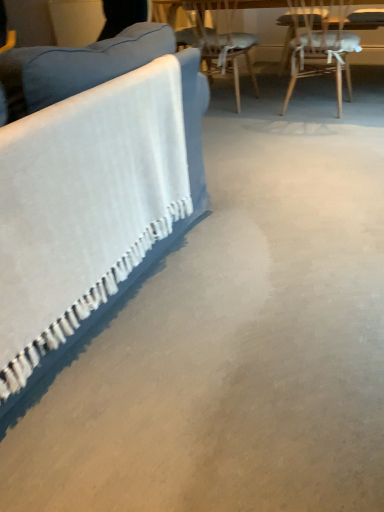
Consider the image. Measure the distance between point (300, 48) and camera.

Point (300, 48) and camera are 9.69 feet apart.

At what (x,y) coordinates should I click in order to perform the action: click on wooden chair at upper right, placed as the first chair when sorted from right to left. Please return your answer as a coordinate pair (x, y). The height and width of the screenshot is (512, 384). Looking at the image, I should click on (320, 42).

I want to click on wooden chair at upper right, which ranks as the 2th chair in left-to-right order, so click(x=320, y=42).

Is wooden chair at upper right, which ranks as the 2th chair in left-to-right order, wider or thinner than wooden chair at upper right, arranged as the 1th chair when viewed from the left?

wooden chair at upper right, which ranks as the 2th chair in left-to-right order, is wider than wooden chair at upper right, arranged as the 1th chair when viewed from the left.

From the image's perspective, does wooden chair at upper right, which ranks as the 2th chair in left-to-right order, appear lower than wooden chair at upper right, which is the second chair in right-to-left order?

Yes, from the image's perspective, wooden chair at upper right, which ranks as the 2th chair in left-to-right order, is below wooden chair at upper right, which is the second chair in right-to-left order.

Are wooden chair at upper right, placed as the first chair when sorted from right to left, and wooden chair at upper right, arranged as the 1th chair when viewed from the left, located far from each other?

No, wooden chair at upper right, placed as the first chair when sorted from right to left, is in close proximity to wooden chair at upper right, arranged as the 1th chair when viewed from the left.

How far apart are wooden chair at upper right, placed as the first chair when sorted from right to left, and wooden chair at upper right, arranged as the 1th chair when viewed from the left?

wooden chair at upper right, placed as the first chair when sorted from right to left, and wooden chair at upper right, arranged as the 1th chair when viewed from the left, are 24.67 inches apart.

From a real-world perspective, is blue fabric couch at left physically located above or below wooden chair at upper right, which is the second chair in right-to-left order?

blue fabric couch at left is situated higher than wooden chair at upper right, which is the second chair in right-to-left order, in the real world.

Based on the photo, considering the relative sizes of blue fabric couch at left and wooden chair at upper right, arranged as the 1th chair when viewed from the left, in the image provided, is blue fabric couch at left taller than wooden chair at upper right, arranged as the 1th chair when viewed from the left,?

Yes, blue fabric couch at left is taller than wooden chair at upper right, arranged as the 1th chair when viewed from the left.

Is blue fabric couch at left inside or outside of wooden chair at upper right, which is the second chair in right-to-left order?

blue fabric couch at left lies outside wooden chair at upper right, which is the second chair in right-to-left order.

Does blue fabric couch at left touch wooden chair at upper right, arranged as the 1th chair when viewed from the left?

blue fabric couch at left is not next to wooden chair at upper right, arranged as the 1th chair when viewed from the left, and they're not touching.

Is blue fabric couch at left in front of or behind wooden chair at upper right, which ranks as the 2th chair in left-to-right order, in the image?

blue fabric couch at left is in front of wooden chair at upper right, which ranks as the 2th chair in left-to-right order.

From a real-world perspective, is blue fabric couch at left above or below wooden chair at upper right, placed as the first chair when sorted from right to left?

In terms of real-world spatial position, blue fabric couch at left is above wooden chair at upper right, placed as the first chair when sorted from right to left.

From the image's perspective, is blue fabric couch at left over wooden chair at upper right, which ranks as the 2th chair in left-to-right order?

No.

Considering the positions of objects wooden chair at upper right, arranged as the 1th chair when viewed from the left, and wooden chair at upper right, placed as the first chair when sorted from right to left, in the image provided, who is more to the right, wooden chair at upper right, arranged as the 1th chair when viewed from the left, or wooden chair at upper right, placed as the first chair when sorted from right to left,?

wooden chair at upper right, placed as the first chair when sorted from right to left.

This screenshot has height=512, width=384. I want to click on chair that appears below the wooden chair at upper right, which is the second chair in right-to-left order (from a real-world perspective), so click(320, 42).

Between wooden chair at upper right, arranged as the 1th chair when viewed from the left, and wooden chair at upper right, which ranks as the 2th chair in left-to-right order, which one has smaller width?

wooden chair at upper right, arranged as the 1th chair when viewed from the left, is thinner.

From the picture: From the image's perspective, which one is positioned lower, wooden chair at upper right, which is the second chair in right-to-left order, or blue fabric couch at left?

blue fabric couch at left.

Is wooden chair at upper right, which is the second chair in right-to-left order, bigger than blue fabric couch at left?

No, wooden chair at upper right, which is the second chair in right-to-left order, is not bigger than blue fabric couch at left.

From a real-world perspective, is wooden chair at upper right, which is the second chair in right-to-left order, physically located above or below blue fabric couch at left?

wooden chair at upper right, which is the second chair in right-to-left order, is below blue fabric couch at left.

Which is further, [227,3] or [54,175]?

The point [227,3] is farther from the camera.

What's the angular difference between wooden chair at upper right, which ranks as the 2th chair in left-to-right order, and blue fabric couch at left's facing directions?

The facing directions of wooden chair at upper right, which ranks as the 2th chair in left-to-right order, and blue fabric couch at left are 88.5 degrees apart.

Is blue fabric couch at left a part of wooden chair at upper right, placed as the first chair when sorted from right to left?

No.

Between wooden chair at upper right, which ranks as the 2th chair in left-to-right order, and blue fabric couch at left, which one has larger width?

Answer: blue fabric couch at left.

From the picture: From a real-world perspective, is wooden chair at upper right, which ranks as the 2th chair in left-to-right order, physically above blue fabric couch at left?

Incorrect, from a real-world perspective, wooden chair at upper right, which ranks as the 2th chair in left-to-right order, is lower than blue fabric couch at left.

This screenshot has width=384, height=512. What are the coordinates of `chair above the wooden chair at upper right, which ranks as the 2th chair in left-to-right order (from a real-world perspective)` in the screenshot? It's located at (218, 41).

Identify the location of studio couch lying in front of the wooden chair at upper right, which is the second chair in right-to-left order. (92, 206).

Based on their spatial positions, is wooden chair at upper right, which ranks as the 2th chair in left-to-right order, or wooden chair at upper right, arranged as the 1th chair when viewed from the left, further from blue fabric couch at left?

The object further to blue fabric couch at left is wooden chair at upper right, arranged as the 1th chair when viewed from the left.

Estimate the real-world distances between objects in this image. Which object is closer to wooden chair at upper right, arranged as the 1th chair when viewed from the left, blue fabric couch at left or wooden chair at upper right, placed as the first chair when sorted from right to left?

Based on the image, wooden chair at upper right, placed as the first chair when sorted from right to left, appears to be nearer to wooden chair at upper right, arranged as the 1th chair when viewed from the left.

From the image, which object appears to be farther from wooden chair at upper right, arranged as the 1th chair when viewed from the left, wooden chair at upper right, which ranks as the 2th chair in left-to-right order, or blue fabric couch at left?

blue fabric couch at left is positioned further to the anchor wooden chair at upper right, arranged as the 1th chair when viewed from the left.

When comparing their distances from wooden chair at upper right, placed as the first chair when sorted from right to left, does blue fabric couch at left or wooden chair at upper right, arranged as the 1th chair when viewed from the left, seem closer?

The object closer to wooden chair at upper right, placed as the first chair when sorted from right to left, is wooden chair at upper right, arranged as the 1th chair when viewed from the left.

Estimate the real-world distances between objects in this image. Which object is further from blue fabric couch at left, wooden chair at upper right, which is the second chair in right-to-left order, or wooden chair at upper right, placed as the first chair when sorted from right to left?

wooden chair at upper right, which is the second chair in right-to-left order, is further to blue fabric couch at left.

Considering their positions, is wooden chair at upper right, which is the second chair in right-to-left order, positioned further to wooden chair at upper right, which ranks as the 2th chair in left-to-right order, than blue fabric couch at left?

blue fabric couch at left is positioned further to the anchor wooden chair at upper right, which ranks as the 2th chair in left-to-right order.

Find the location of a particular element. chair located between blue fabric couch at left and wooden chair at upper right, which is the second chair in right-to-left order, in the depth direction is located at coordinates (320, 42).